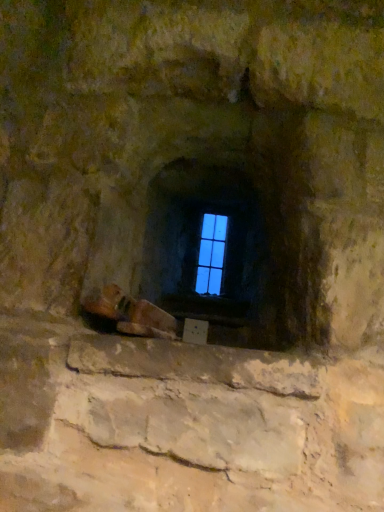
You are a GUI agent. You are given a task and a screenshot of the screen. Output one action in this format:
    pyautogui.click(x=<x>, y=<y>)
    Task: Click on the leather brown shoe at lower center
    This screenshot has height=512, width=384.
    Given the screenshot: What is the action you would take?
    pyautogui.click(x=132, y=314)

Describe the element at coordinates (132, 314) in the screenshot. I see `leather brown shoe at lower center` at that location.

Identify the location of blue glass window at center. The width and height of the screenshot is (384, 512). (211, 254).

The height and width of the screenshot is (512, 384). What do you see at coordinates (211, 254) in the screenshot? I see `blue glass window at center` at bounding box center [211, 254].

The height and width of the screenshot is (512, 384). Identify the location of leather brown shoe at lower center. (132, 314).

Considering the positions of objects leather brown shoe at lower center and blue glass window at center in the image provided, who is more to the right, leather brown shoe at lower center or blue glass window at center?

From the viewer's perspective, blue glass window at center appears more on the right side.

Considering the positions of objects leather brown shoe at lower center and blue glass window at center in the image provided, who is in front, leather brown shoe at lower center or blue glass window at center?

leather brown shoe at lower center is in front.

Between point (138, 298) and point (201, 248), which one is positioned behind?

The point (201, 248) is behind.

From the image's perspective, is leather brown shoe at lower center on top of blue glass window at center?

No, from the image's perspective, leather brown shoe at lower center is not above blue glass window at center.

From a real-world perspective, which is physically above, leather brown shoe at lower center or blue glass window at center?

blue glass window at center, from a real-world perspective.

Which of these two, leather brown shoe at lower center or blue glass window at center, is wider?

With larger width is leather brown shoe at lower center.

Considering the sizes of objects leather brown shoe at lower center and blue glass window at center in the image provided, who is taller, leather brown shoe at lower center or blue glass window at center?

blue glass window at center.

Which of these two, leather brown shoe at lower center or blue glass window at center, is bigger?

leather brown shoe at lower center is bigger.

Is leather brown shoe at lower center outside of blue glass window at center?

Absolutely, leather brown shoe at lower center is external to blue glass window at center.

Is leather brown shoe at lower center not close to blue glass window at center?

Indeed, leather brown shoe at lower center is not near blue glass window at center.

Is leather brown shoe at lower center turned away from blue glass window at center?

No, leather brown shoe at lower center is not facing away from blue glass window at center.

Can you tell me how much leather brown shoe at lower center and blue glass window at center differ in facing direction?

9.83 degrees separate the facing orientations of leather brown shoe at lower center and blue glass window at center.

Image resolution: width=384 pixels, height=512 pixels. I want to click on window that is above the leather brown shoe at lower center (from a real-world perspective), so click(x=211, y=254).

Is blue glass window at center to the right of leather brown shoe at lower center from the viewer's perspective?

Yes.

Is the depth of blue glass window at center greater than that of leather brown shoe at lower center?

Yes, it is.

Considering the points (205, 249) and (153, 310), which point is behind, point (205, 249) or point (153, 310)?

The point (205, 249) is more distant.

From the image's perspective, is blue glass window at center on top of leather brown shoe at lower center?

Yes.

From a real-world perspective, is blue glass window at center positioned over leather brown shoe at lower center based on gravity?

Yes, from a real-world perspective, blue glass window at center is over leather brown shoe at lower center

Based on the photo, considering the sizes of objects blue glass window at center and leather brown shoe at lower center in the image provided, who is wider, blue glass window at center or leather brown shoe at lower center?

leather brown shoe at lower center.

Considering the sizes of objects blue glass window at center and leather brown shoe at lower center in the image provided, who is shorter, blue glass window at center or leather brown shoe at lower center?

leather brown shoe at lower center.

Based on the photo, is blue glass window at center smaller than leather brown shoe at lower center?

Correct, blue glass window at center occupies less space than leather brown shoe at lower center.

Is leather brown shoe at lower center completely or partially inside blue glass window at center?

No, leather brown shoe at lower center is located outside of blue glass window at center.

From the picture: Is blue glass window at center not close to leather brown shoe at lower center?

That's right, there is a large distance between blue glass window at center and leather brown shoe at lower center.

Is blue glass window at center oriented away from leather brown shoe at lower center?

No, blue glass window at center is not facing away from leather brown shoe at lower center.

How different are the orientations of blue glass window at center and leather brown shoe at lower center in degrees?

The angular difference between blue glass window at center and leather brown shoe at lower center is 9.83 degrees.

How far apart are blue glass window at center and leather brown shoe at lower center?

blue glass window at center is 1.01 meters away from leather brown shoe at lower center.

I want to click on window that is above the leather brown shoe at lower center (from a real-world perspective), so click(x=211, y=254).

Where is `window on the right of the leather brown shoe at lower center`? window on the right of the leather brown shoe at lower center is located at coordinates (211, 254).

Identify the location of footwear that appears in front of the blue glass window at center. The width and height of the screenshot is (384, 512). (132, 314).